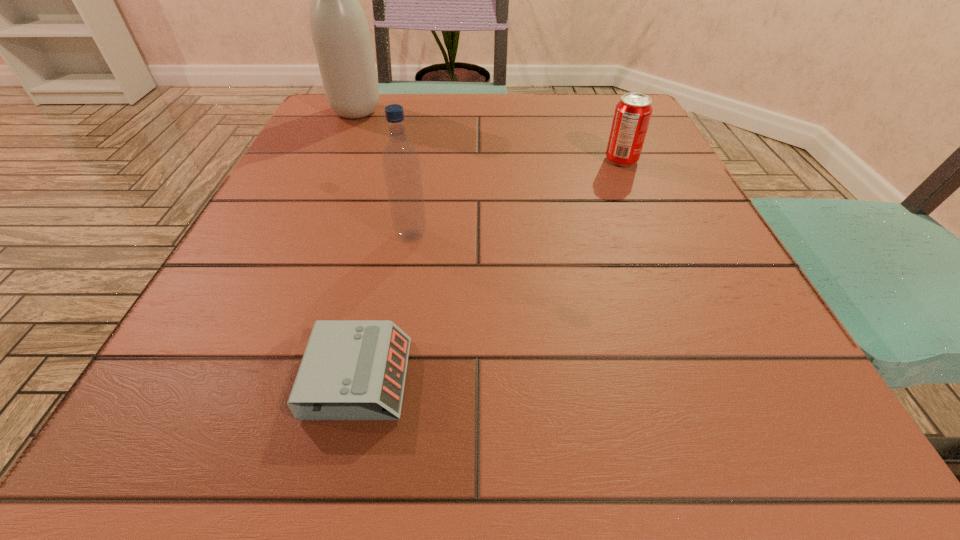
Find the location of `free space between the alarm clock and the farthest object`. free space between the alarm clock and the farthest object is located at coordinates (357, 245).

At what (x,y) coordinates should I click in order to perform the action: click on vacant space that's between the soda and the water bottle. Please return your answer as a coordinate pair (x, y). The image size is (960, 540). Looking at the image, I should click on (516, 198).

Find the location of `object that is the second closest to the rightmost object`. object that is the second closest to the rightmost object is located at coordinates (340, 33).

Locate an element on the screen. This screenshot has height=540, width=960. object that is the closest to the water bottle is located at coordinates (351, 369).

This screenshot has width=960, height=540. Find the location of `vacant region that satisfies the following two spatial constraints: 1. on the front side of the leftmost object; 2. on the right side of the third farthest object`. vacant region that satisfies the following two spatial constraints: 1. on the front side of the leftmost object; 2. on the right side of the third farthest object is located at coordinates (301, 236).

Find the location of a particular element. Image resolution: width=960 pixels, height=540 pixels. blank area in the image that satisfies the following two spatial constraints: 1. on the back side of the second shortest object; 2. on the right side of the third shortest object is located at coordinates (424, 160).

The image size is (960, 540). In order to click on vacant region that satisfies the following two spatial constraints: 1. on the front side of the alarm clock; 2. on the right side of the tallest object in this screenshot , I will do `click(238, 378)`.